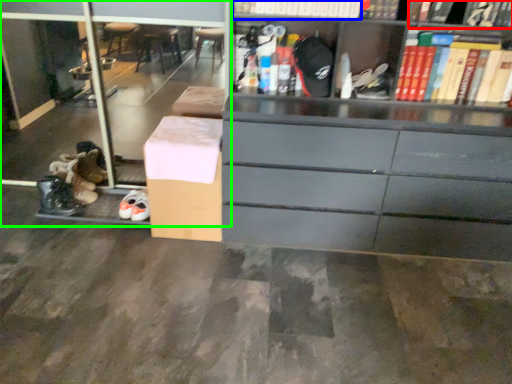
Question: Based on their relative distances, which object is farther from book (highlighted by a red box)? Choose from book (highlighted by a blue box) and shelf (highlighted by a green box).

Choices:
 (A) book
 (B) shelf

Answer: (B)